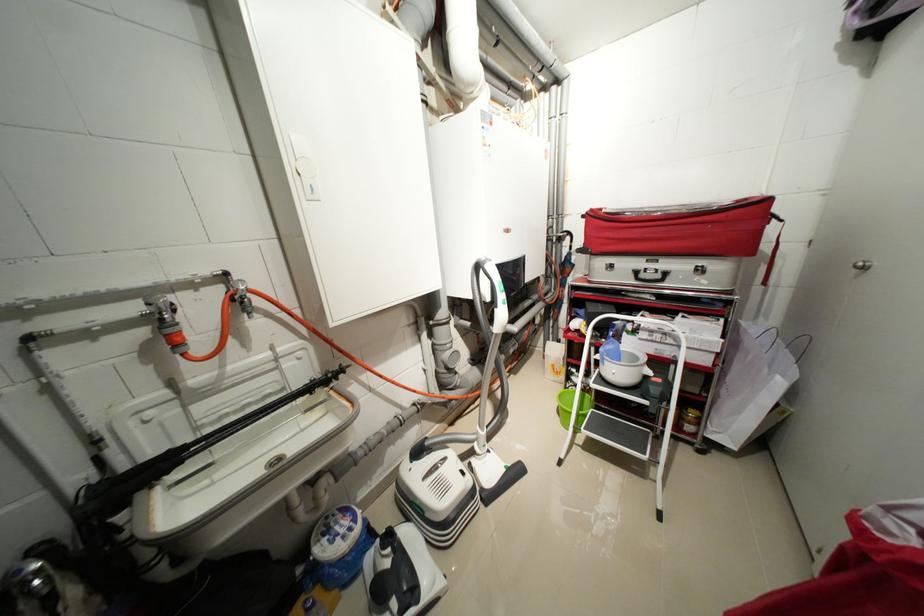
Locate an element on the screen. This screenshot has width=924, height=616. white cabinet handle is located at coordinates (307, 177).